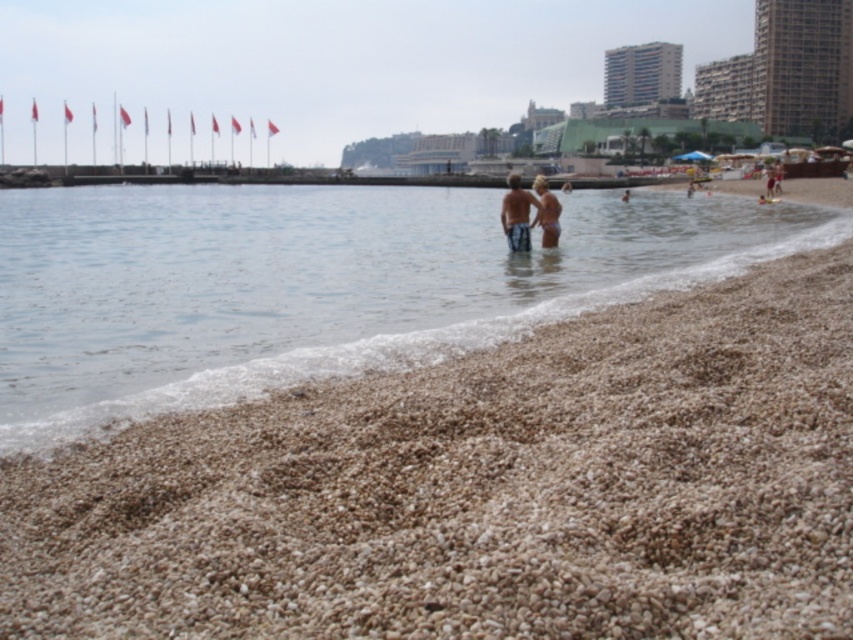
Question: Which object is the farthest from the light brown bikini at center?

Choices:
 (A) brown gravel at lower center
 (B) matte skin couple at center

Answer: (A)

Question: Based on their relative distances, which object is nearer to the light brown bikini at center?

Choices:
 (A) matte skin couple at center
 (B) brown gravel at lower center

Answer: (A)

Question: Is matte skin couple at center bigger than light brown bikini at center?

Choices:
 (A) yes
 (B) no

Answer: (A)

Question: Is brown gravel at lower center positioned before matte skin couple at center?

Choices:
 (A) no
 (B) yes

Answer: (B)

Question: Among these points, which one is farthest from the camera?

Choices:
 (A) (549, 212)
 (B) (554, 220)

Answer: (B)

Question: Can you confirm if brown gravel at lower center is thinner than light brown bikini at center?

Choices:
 (A) no
 (B) yes

Answer: (A)